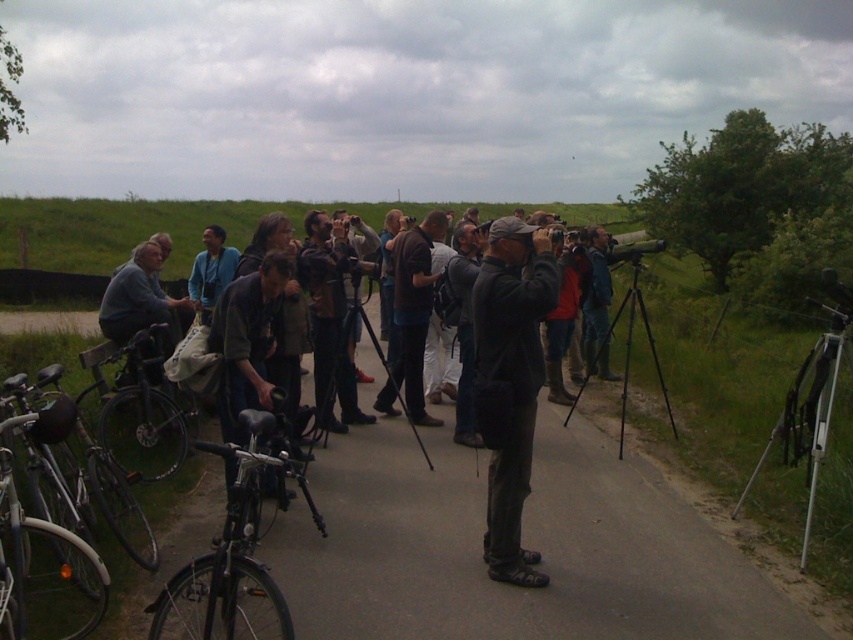
Question: Does dark blue fabric jacket at center have a larger size compared to dark gray fabric jacket at center?

Choices:
 (A) yes
 (B) no

Answer: (A)

Question: Does dark gray fabric jacket at center lie in front of brown fabric shirt at center?

Choices:
 (A) no
 (B) yes

Answer: (B)

Question: Which point is farther to the camera?

Choices:
 (A) brown fabric shirt at center
 (B) blue fabric jacket at center
 (C) dark gray asphalt road at center

Answer: (A)

Question: Based on their relative distances, which object is farther from the shiny black bicycle at left?

Choices:
 (A) black matte bicycle at left
 (B) black matte tripod at center
 (C) dark gray fabric jacket at center

Answer: (B)

Question: Which object is closer to the camera taking this photo?

Choices:
 (A) dark blue fabric jacket at center
 (B) dark gray asphalt road at center
 (C) silver metallic bicycle at left

Answer: (C)

Question: Does dark gray asphalt road at center have a lesser width compared to silver metallic tripod at lower right?

Choices:
 (A) no
 (B) yes

Answer: (A)